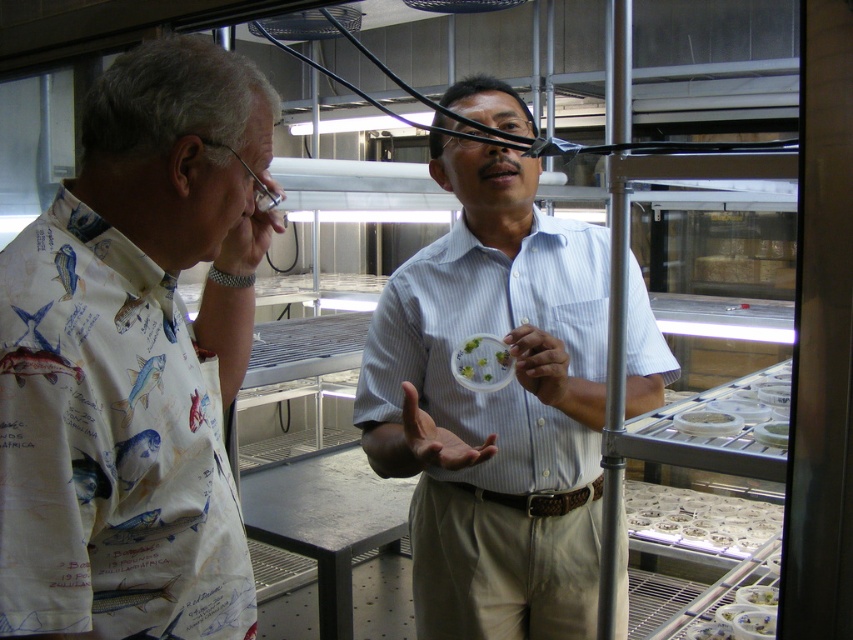
Question: Does translucent plastic container at center appear under white matte container at center?

Choices:
 (A) no
 (B) yes

Answer: (A)

Question: Which object is positioned closest to the green matte food at center?

Choices:
 (A) translucent plastic container at center
 (B) white striped shirt at center

Answer: (A)

Question: Can you confirm if white printed shirt at left is smaller than white matte container at center?

Choices:
 (A) no
 (B) yes

Answer: (A)

Question: From the image, what is the correct spatial relationship of white matte container at center in relation to green matte food at center?

Choices:
 (A) below
 (B) above

Answer: (A)

Question: Estimate the real-world distances between objects in this image. Which object is farther from the green matte food at center?

Choices:
 (A) white printed shirt at left
 (B) white matte container at center

Answer: (A)

Question: Which of the following is the closest to the observer?

Choices:
 (A) (190, 141)
 (B) (585, 625)
 (C) (683, 422)

Answer: (A)